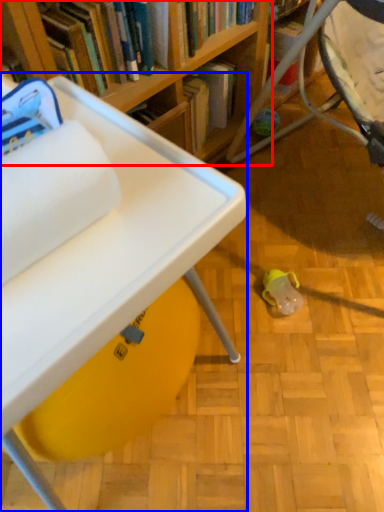
Question: Which object is closer to the camera taking this photo, bookcase (highlighted by a red box) or table (highlighted by a blue box)?

Choices:
 (A) bookcase
 (B) table

Answer: (B)